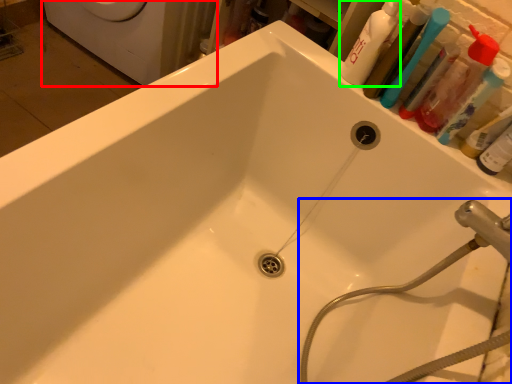
Question: Which is farther away from washing machine (highlighted by a red box)? plumbing fixture (highlighted by a blue box) or cleaning product (highlighted by a green box)?

Choices:
 (A) plumbing fixture
 (B) cleaning product

Answer: (A)